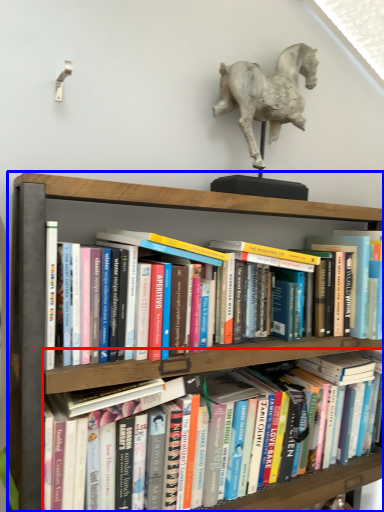
Question: Which object appears closest to the camera in this image, book (highlighted by a red box) or shelf (highlighted by a blue box)?

Choices:
 (A) book
 (B) shelf

Answer: (B)